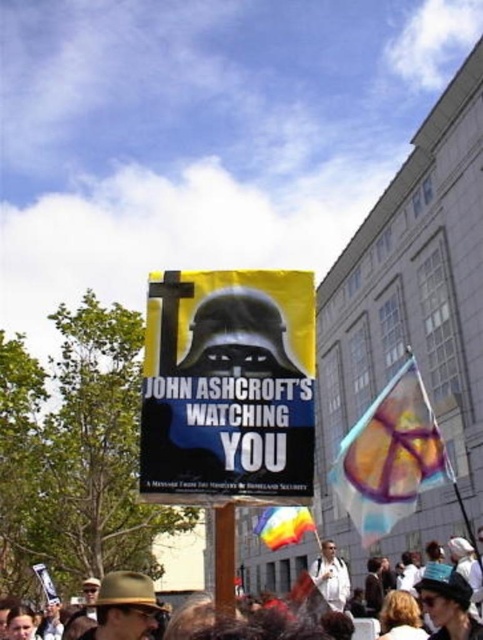
Question: Is white cotton shirt at lower center above white shirt at center?

Choices:
 (A) yes
 (B) no

Answer: (B)

Question: Estimate the real-world distances between objects in this image. Which object is closer to the white cotton shirt at lower center?

Choices:
 (A) white shirt at center
 (B) yellow paper poster at center

Answer: (A)

Question: Is yellow paper poster at center behind white cotton shirt at lower center?

Choices:
 (A) no
 (B) yes

Answer: (A)

Question: Which point appears closest to the camera in this image?

Choices:
 (A) (332, 588)
 (B) (90, 595)
 (C) (148, 324)

Answer: (C)

Question: Does yellow paper poster at center have a smaller size compared to white shirt at center?

Choices:
 (A) no
 (B) yes

Answer: (B)

Question: Among these objects, which one is farthest from the camera?

Choices:
 (A) white shirt at center
 (B) yellow paper poster at center

Answer: (A)